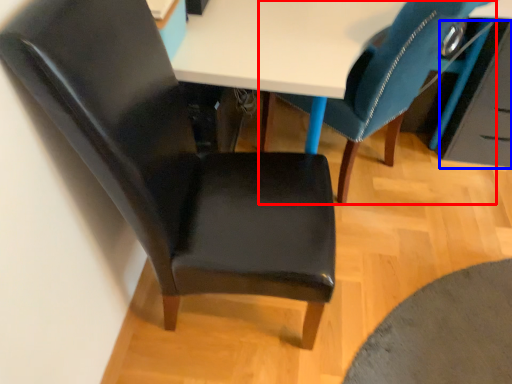
Question: Which object appears farthest to the camera in this image, chair (highlighted by a red box) or drawer (highlighted by a blue box)?

Choices:
 (A) chair
 (B) drawer

Answer: (B)